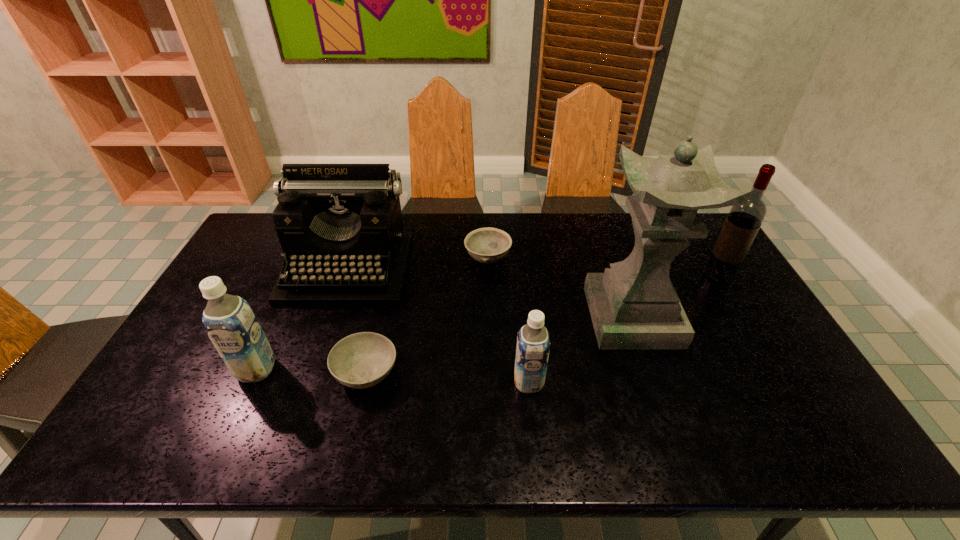
The image size is (960, 540). Identify the location of vacant space located on the typing side of the typewriter. (330, 321).

This screenshot has height=540, width=960. Find the location of `free point located 0.290m on the right of the left bowl`. free point located 0.290m on the right of the left bowl is located at coordinates point(509,372).

This screenshot has height=540, width=960. I want to click on bowl present at the far edge, so click(488, 245).

Locate an element on the screen. The width and height of the screenshot is (960, 540). typewriter that is at the far edge is located at coordinates (340, 226).

You are a GUI agent. You are given a task and a screenshot of the screen. Output one action in this format:
    pyautogui.click(x=<x>, y=<y>)
    Task: Click on the bowl situated at the near edge
    This screenshot has height=540, width=960.
    Given the screenshot: What is the action you would take?
    pyautogui.click(x=361, y=360)

Identify the location of object at the right edge. The width and height of the screenshot is (960, 540). (743, 222).

You are a GUI agent. You are given a task and a screenshot of the screen. Output one action in this format:
    pyautogui.click(x=<x>, y=<y>)
    Task: Click on the vacant space at the far edge
    This screenshot has height=540, width=960.
    Given the screenshot: What is the action you would take?
    pyautogui.click(x=419, y=230)

Identify the location of free space at the near edge of the desktop. Image resolution: width=960 pixels, height=540 pixels. (666, 399).

Where is `vacant space at the right edge`? This screenshot has height=540, width=960. vacant space at the right edge is located at coordinates (737, 336).

Identify the location of free space at the near right corner of the desktop. (785, 384).